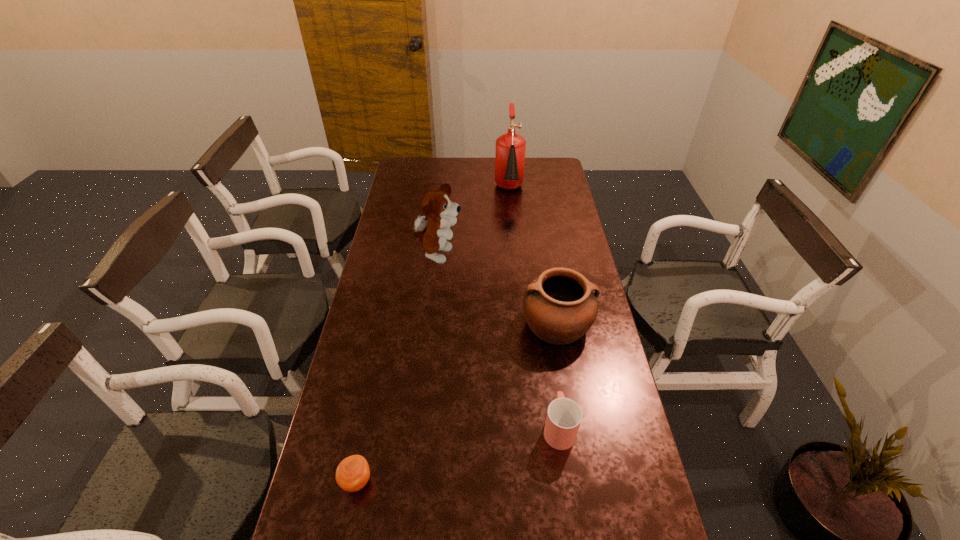
Identify the location of vacant position located 0.340m with the nozzle aimed from the tallest object. The height and width of the screenshot is (540, 960). (515, 254).

Locate an element on the screen. free region located 0.300m on the face of the second tallest object is located at coordinates (537, 255).

The width and height of the screenshot is (960, 540). Find the location of `vacant area located on the left of the third farthest object`. vacant area located on the left of the third farthest object is located at coordinates (501, 324).

Locate an element on the screen. The image size is (960, 540). blank space located on the side of the fourth tallest object with the handle is located at coordinates tap(544, 321).

You are a GUI agent. You are given a task and a screenshot of the screen. Output one action in this format:
    pyautogui.click(x=<x>, y=<y>)
    Task: Click on the blank space located on the side of the fourth tallest object with the handle
    
    Given the screenshot: What is the action you would take?
    pyautogui.click(x=545, y=333)

This screenshot has width=960, height=540. I want to click on free space located 0.190m on the side of the fourth tallest object with the handle, so click(x=548, y=354).

Find the location of a particular element. This screenshot has width=960, height=540. free spot located on the right of the leftmost object is located at coordinates (493, 481).

Where is `object present at the far edge`? The height and width of the screenshot is (540, 960). object present at the far edge is located at coordinates (510, 148).

Image resolution: width=960 pixels, height=540 pixels. In order to click on puppy present at the left edge in this screenshot , I will do `click(433, 229)`.

I want to click on orange that is at the left edge, so click(352, 474).